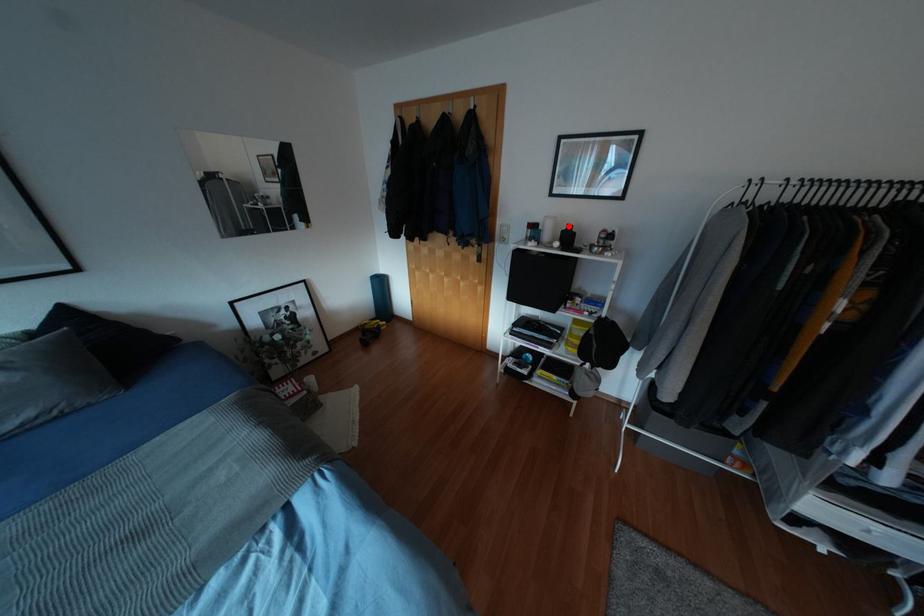
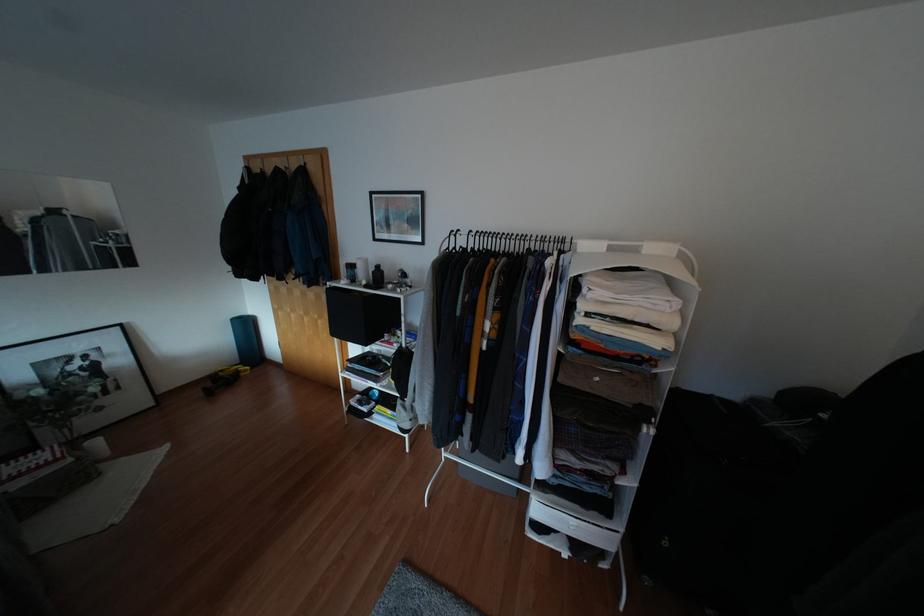
The point at the highlighted location is marked in the first image. Where is the corresponding point in the second image?

(377, 265)